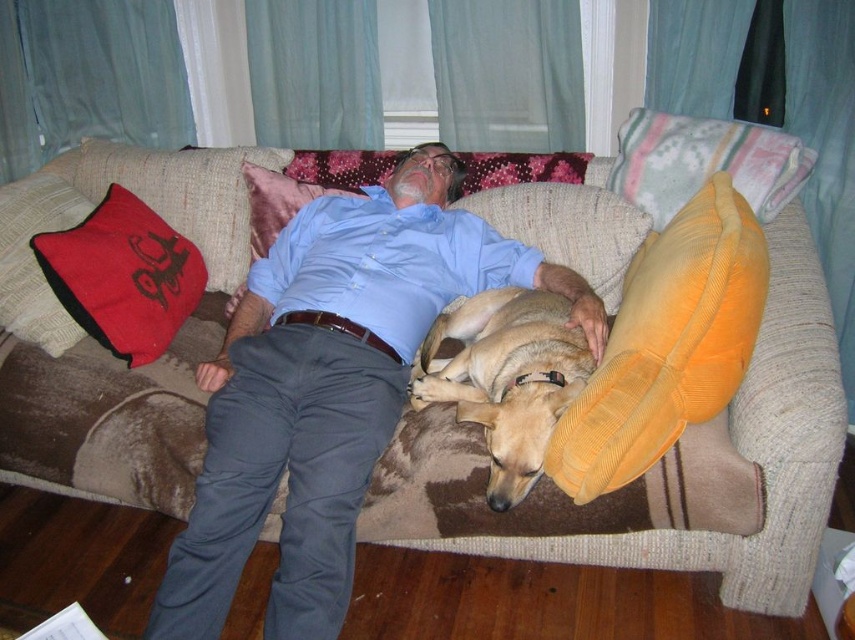
Who is positioned more to the right, orange corduroy pillow at right or red corduroy pillow at upper center?

orange corduroy pillow at right is more to the right.

Who is more forward, (670, 340) or (302, 193)?

Point (670, 340) is more forward.

What do you see at coordinates (667, 344) in the screenshot?
I see `orange corduroy pillow at right` at bounding box center [667, 344].

In order to click on orange corduroy pillow at right in this screenshot , I will do `click(667, 344)`.

Who is shorter, blue cotton shirt at center or red corduroy pillow at upper center?

Standing shorter between the two is red corduroy pillow at upper center.

In the scene shown: Does blue cotton shirt at center appear over red corduroy pillow at upper center?

Actually, blue cotton shirt at center is below red corduroy pillow at upper center.

Is point (423, 298) in front of point (268, 205)?

Yes, it is.

Where is `blue cotton shirt at center`? The image size is (855, 640). blue cotton shirt at center is located at coordinates (329, 387).

Is point (91, 228) behind point (261, 240)?

No, it is not.

You are a GUI agent. You are given a task and a screenshot of the screen. Output one action in this format:
    pyautogui.click(x=<x>, y=<y>)
    Task: Click on the velvet red pillow at left
    The image size is (855, 640).
    Given the screenshot: What is the action you would take?
    pyautogui.click(x=122, y=275)